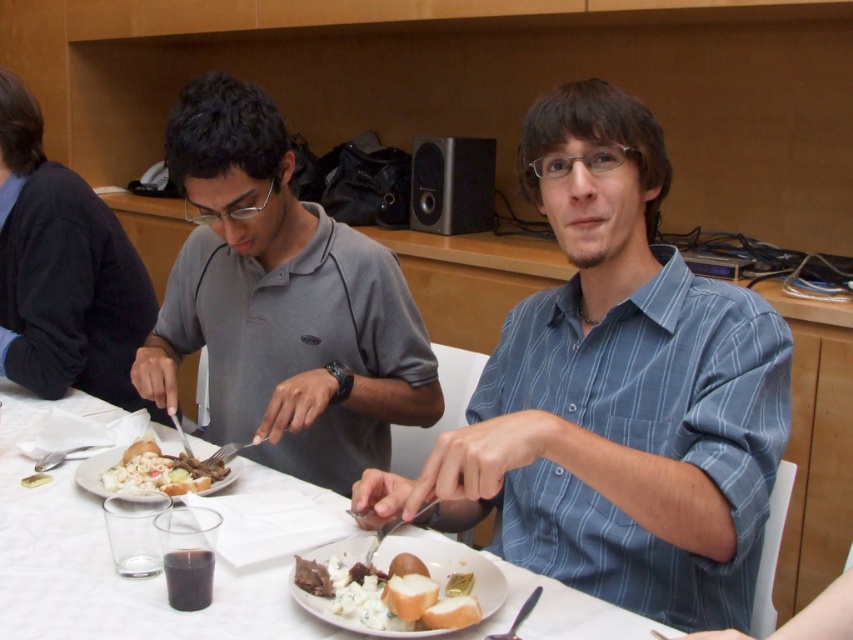
You are a waiter in a restaurant. You need to deliver a drink to the gray matte shirt at left. The drink is currently on the white paper plate at center. Can you reach the drink without moving the plate?

The distance between the gray matte shirt at left and the white paper plate at center is 11.55 inches. Since the shirt is 11.55 inches away from the plate, the waiter can reach the drink by extending their arm to pick it up from the plate without needing to move the plate itself.

You are a photographer setting up a shot of the dining scene. You need to ensure that the black sweater at left and the white bread at lower center are both visible in the frame. Given their sizes, which object should you prioritize positioning closer to the camera to maintain clarity?

The black sweater at left is taller than the white bread at lower center. To maintain clarity, prioritize positioning the black sweater at left closer to the camera since it is larger and might require more focus.

You are a waiter in the dining area. You need to deliver a drink to the gray matte shirt at left and the white paper plate at center. Which one is closer to you from your current position?

The gray matte shirt at left is located above the white paper plate at center, so the gray matte shirt at left is closer to you.